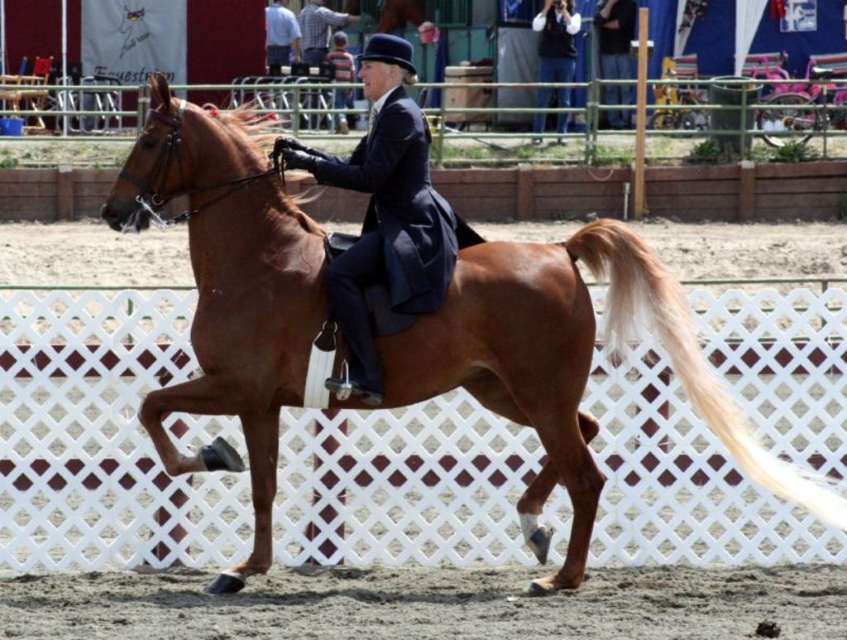
You are a photographer positioned at the point with coordinates (567, 368). You want to capture a photo of the brown glossy horse at center. Is your current position suitable for taking a clear photo of the brown glossy horse at center?

The point (567, 368) indicates the brown glossy horse at center, so yes, your current position is suitable for taking a clear photo of the brown glossy horse at center.

You are a spectator at the equestrian event. You notice the brown glossy horse at center and the shiny navy blue riding jacket at center. Which object is positioned lower in the image?

The brown glossy horse at center is positioned lower than the shiny navy blue riding jacket at center in the image.

You are a photographer trying to capture the rider and horse in the arena. You want to ensure both the brown glossy horse at center and the shiny navy blue riding jacket at center are clearly visible in your photo. Given their sizes, which one should you focus on to ensure proper framing?

The brown glossy horse at center is bigger than the shiny navy blue riding jacket at center, so focusing on the horse will ensure proper framing as it occupies more space in the image.